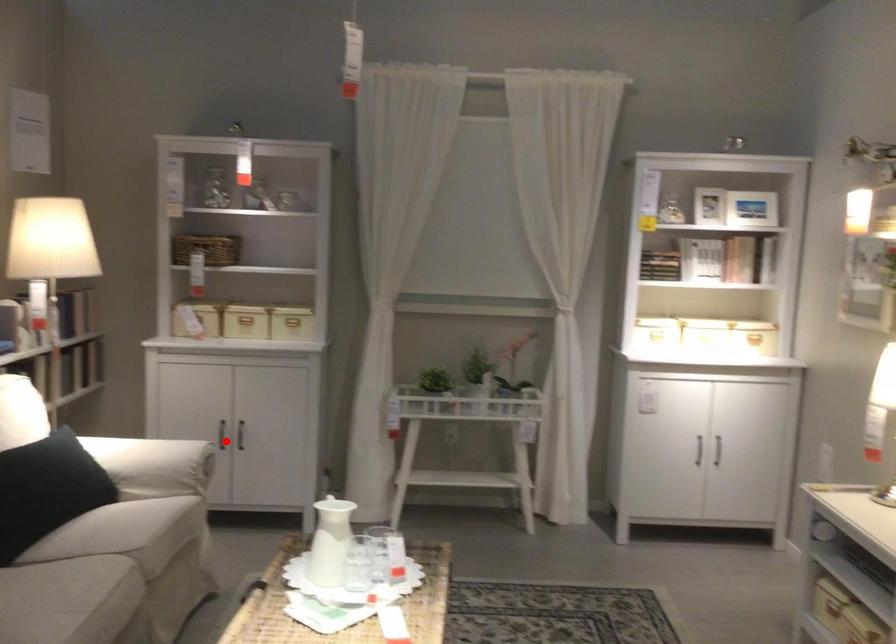
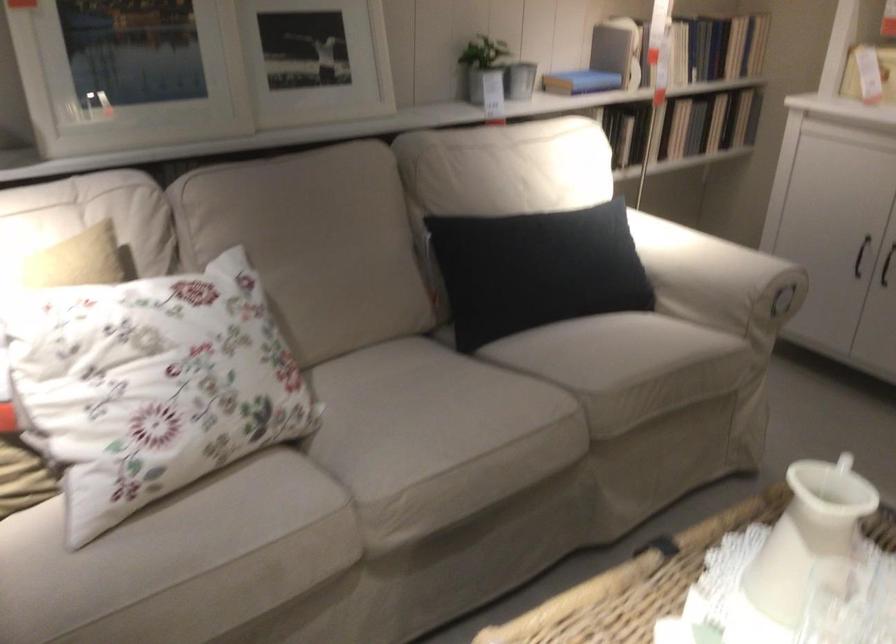
Question: I am providing you with two images of the same scene from different viewpoints. Given a red point in image1, look at the same physical point in image2. Is it:

Choices:
 (A) Closer to the viewpoint
 (B) Farther from the viewpoint

Answer: (A)